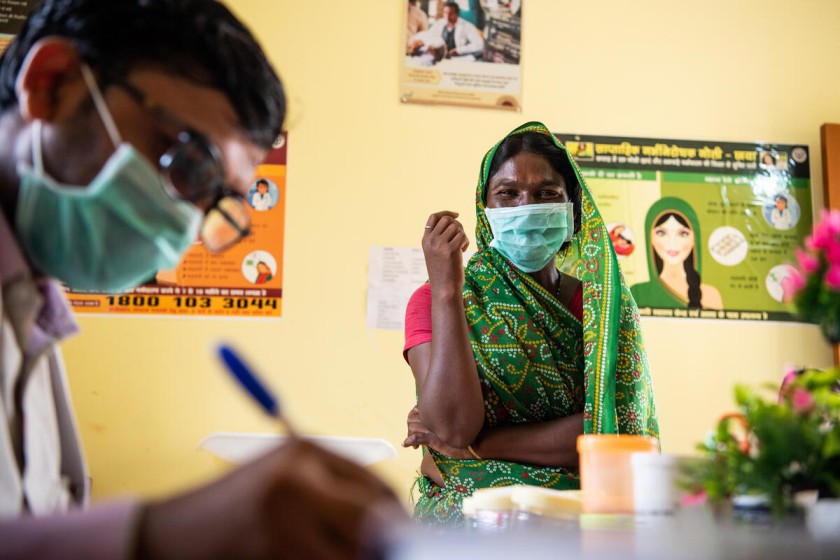
Find the location of a particular element. pen is located at coordinates (264, 395).